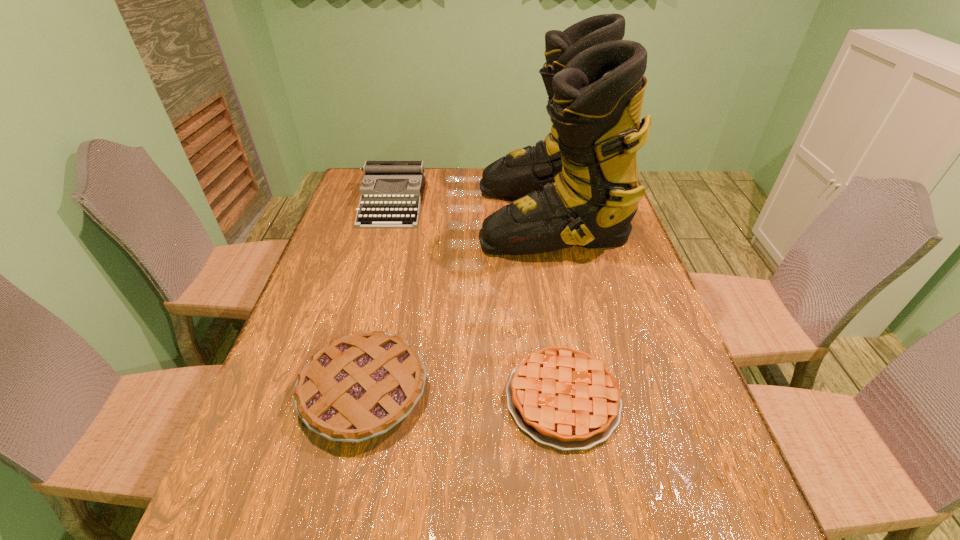
You are a GUI agent. You are given a task and a screenshot of the screen. Output one action in this format:
    pyautogui.click(x=<x>, y=<y>)
    Task: Click on the tallest object
    
    Given the screenshot: What is the action you would take?
    pyautogui.click(x=579, y=186)

Where is `typewriter`? The image size is (960, 540). typewriter is located at coordinates (391, 192).

You are a GUI agent. You are given a task and a screenshot of the screen. Output one action in this format:
    pyautogui.click(x=<x>, y=<y>)
    Task: Click on the taller pie
    The image size is (960, 540).
    Given the screenshot: What is the action you would take?
    pyautogui.click(x=360, y=386)

The image size is (960, 540). What are the coordinates of `the second shortest object` in the screenshot? It's located at (360, 386).

Locate an element on the screen. The height and width of the screenshot is (540, 960). the shorter pie is located at coordinates (564, 398).

The image size is (960, 540). Identify the location of the shortest object. (564, 398).

Locate an element on the screen. vacant space located on the left of the tallest object is located at coordinates (418, 215).

Find the location of `free space located on the typing side of the second tallest object`. free space located on the typing side of the second tallest object is located at coordinates (372, 278).

Locate an element on the screen. The height and width of the screenshot is (540, 960). vacant region located on the front of the left pie is located at coordinates (343, 484).

The width and height of the screenshot is (960, 540). Identify the location of free location located 0.100m on the back of the shortest object. (550, 321).